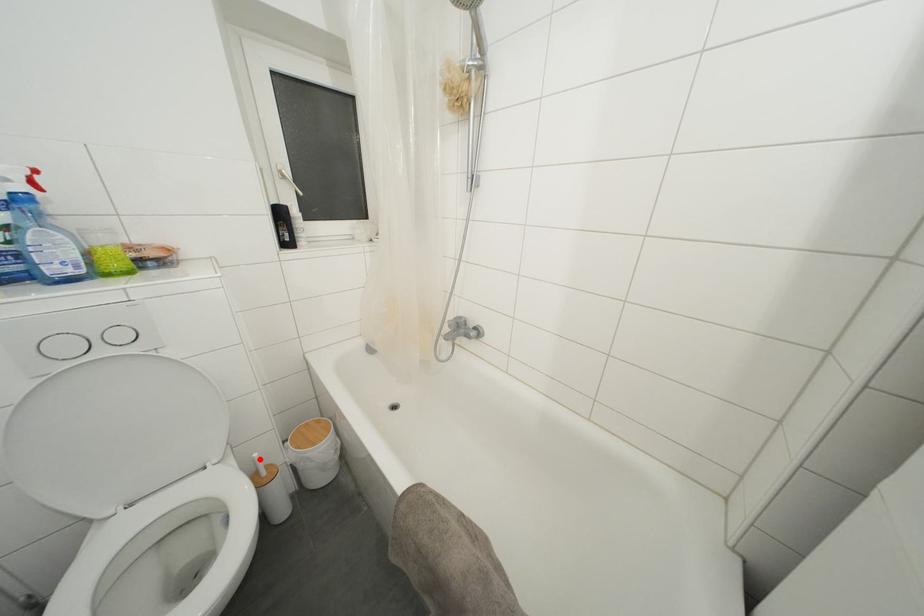
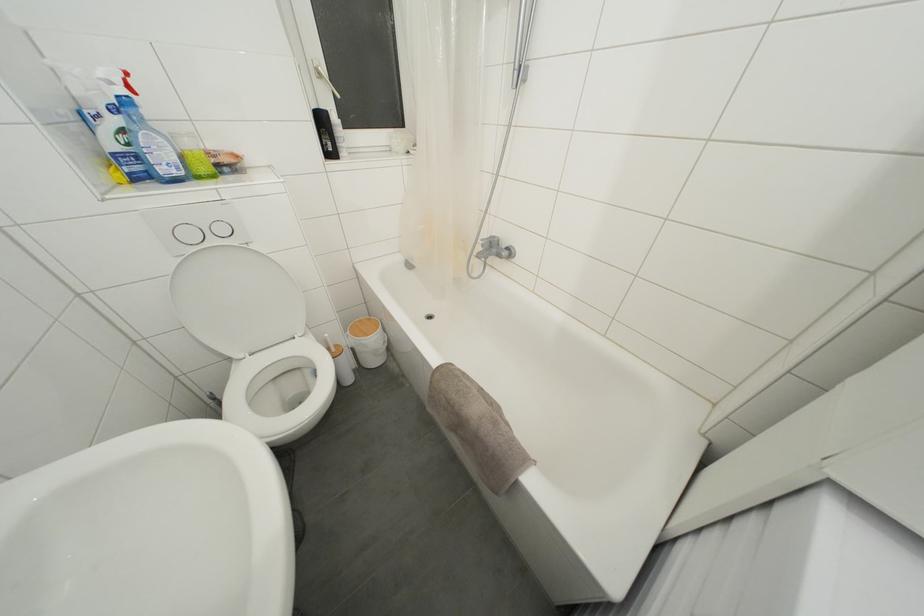
Question: I am providing you with two images of the same scene from different viewpoints. In image1, a red point is highlighted. Considering the same 3D point in image2, which of the following is correct?

Choices:
 (A) It is closer
 (B) It is farther

Answer: (A)